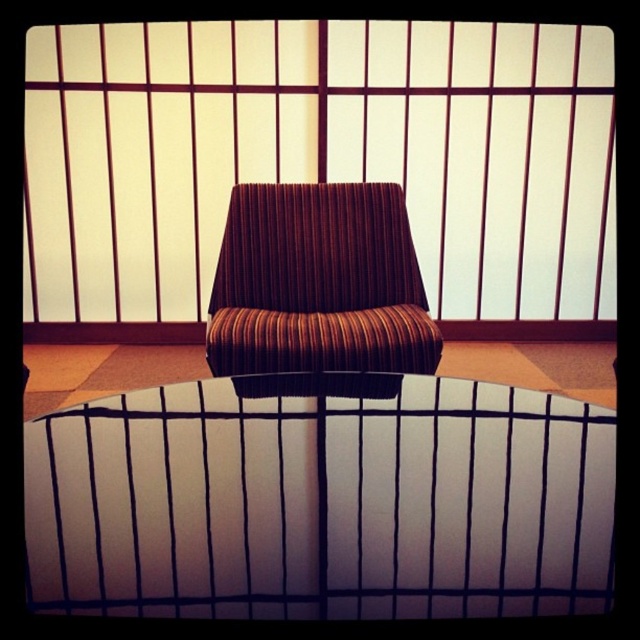
Can you confirm if brown striped cushion at center is positioned to the left of brown striped fabric armchair at center?

In fact, brown striped cushion at center is to the right of brown striped fabric armchair at center.

Does brown striped cushion at center appear over brown striped fabric armchair at center?

Yes.

Is point (602, 321) farther from viewer compared to point (323, 328)?

Yes, it is.

What are the coordinates of `brown striped cushion at center` in the screenshot? It's located at (320, 163).